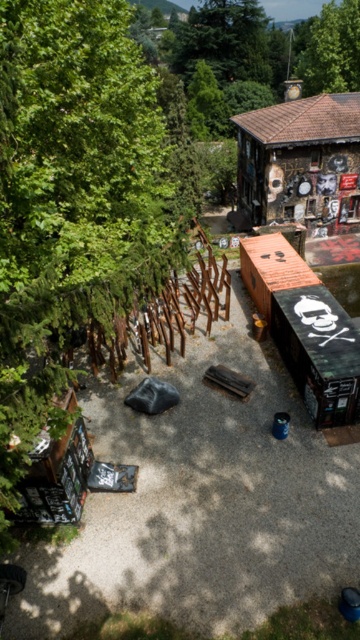
You are planning to set up a small garden in the outdoor urban area shown. You have two options for placement near the wooden textured hut at upper right and the green leafy tree at upper center. Which location would provide more horizontal space for your garden?

The wooden textured hut at upper right is wider than the green leafy tree at upper center, so placing the garden near the wooden textured hut at upper right would provide more horizontal space.